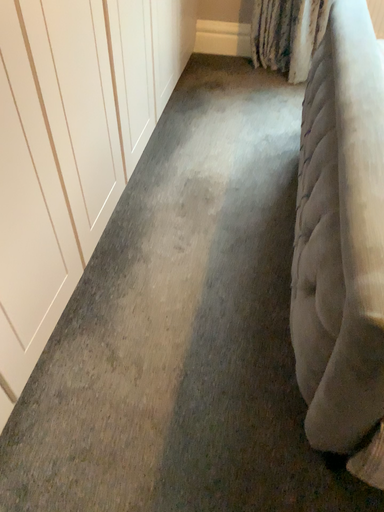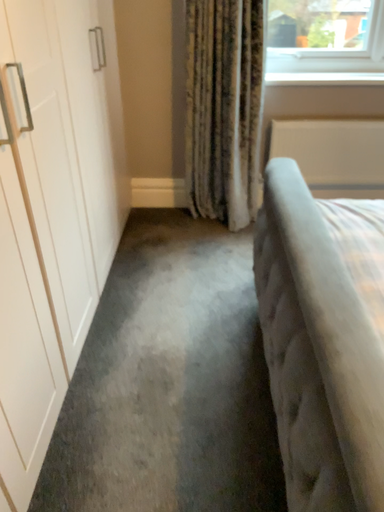
Question: Which way did the camera rotate in the video?

Choices:
 (A) rotated downward
 (B) rotated upward

Answer: (B)